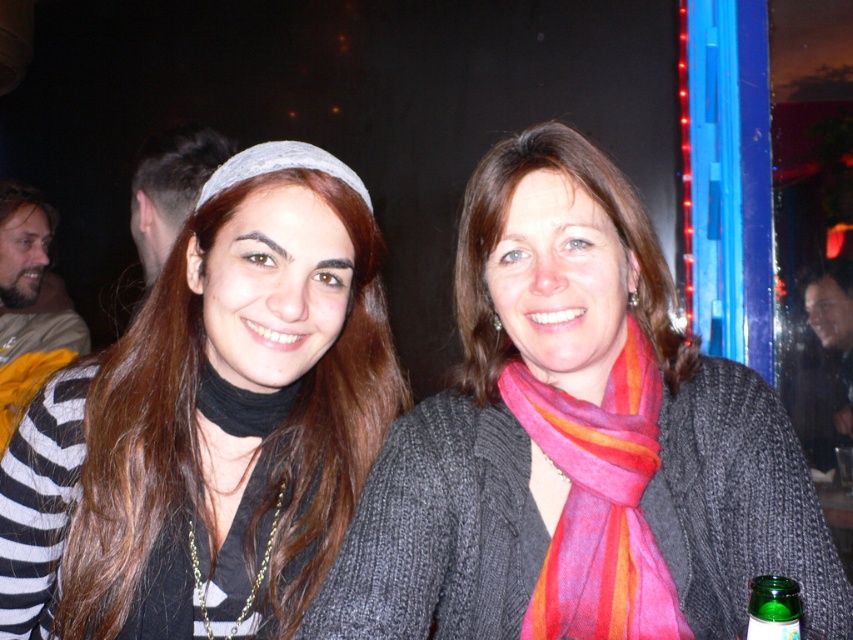
What do you see at coordinates (212, 422) in the screenshot? The height and width of the screenshot is (640, 853). I see `matte black headband at upper left` at bounding box center [212, 422].

Who is more distant from viewer, (0, 481) or (625, 499)?

The point (0, 481) is behind.

The height and width of the screenshot is (640, 853). What are the coordinates of `matte black headband at upper left` in the screenshot? It's located at (212, 422).

Who is more forward, (x=490, y=212) or (x=775, y=593)?

Point (x=775, y=593) is in front.

Which is in front, point (659, 380) or point (776, 632)?

Positioned in front is point (776, 632).

At what (x,y) coordinates should I click in order to perform the action: click on knitted gray sweater at center. Please return your answer as a coordinate pair (x, y). The height and width of the screenshot is (640, 853). Looking at the image, I should click on (578, 403).

Who is more forward, (202,260) or (750,624)?

Point (750,624) is in front.

Measure the distance between matte black headband at upper left and camera.

matte black headband at upper left and camera are 32.77 inches apart from each other.

Identify the location of matte black headband at upper left. The image size is (853, 640). (212, 422).